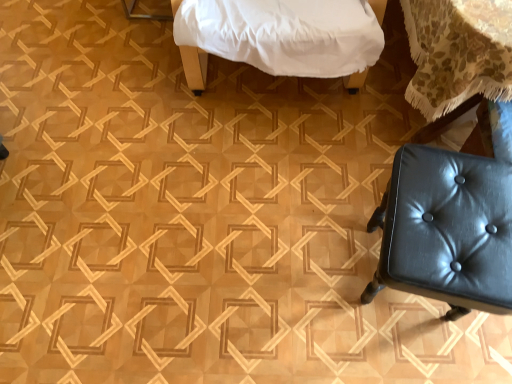
Question: From the image's perspective, is black leather stool at lower right above or below white fabric-covered bed at upper center?

Choices:
 (A) above
 (B) below

Answer: (B)

Question: Is black leather stool at lower right inside the boundaries of white fabric-covered bed at upper center, or outside?

Choices:
 (A) outside
 (B) inside

Answer: (A)

Question: Considering the positions of black leather stool at lower right and white fabric-covered bed at upper center in the image, is black leather stool at lower right wider or thinner than white fabric-covered bed at upper center?

Choices:
 (A) thin
 (B) wide

Answer: (A)

Question: Is point (183, 62) closer or farther from the camera than point (463, 230)?

Choices:
 (A) farther
 (B) closer

Answer: (A)

Question: Is white fabric-covered bed at upper center taller or shorter than black leather stool at lower right?

Choices:
 (A) short
 (B) tall

Answer: (B)

Question: Do you think white fabric-covered bed at upper center is within black leather stool at lower right, or outside of it?

Choices:
 (A) inside
 (B) outside

Answer: (B)

Question: Is white fabric-covered bed at upper center wider or thinner than black leather stool at lower right?

Choices:
 (A) thin
 (B) wide

Answer: (B)